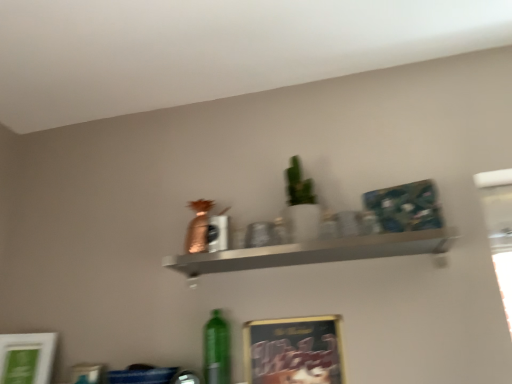
Question: Based on their positions, is metallic silver shelf at center located to the left or right of metallic gold picture frame at lower center, which is the 2th picture frame in left-to-right order?

Choices:
 (A) left
 (B) right

Answer: (B)

Question: Is metallic silver shelf at center bigger or smaller than metallic gold picture frame at lower center, marked as the 1th picture frame in a right-to-left arrangement?

Choices:
 (A) small
 (B) big

Answer: (B)

Question: Which is nearer to the green matte bottle at lower center?

Choices:
 (A) metallic silver shelf at center
 (B) metallic gold picture frame at lower center, marked as the 1th picture frame in a right-to-left arrangement
 (C) white matte picture frame at lower left, the 2th picture frame when ordered from right to left

Answer: (B)

Question: Considering the real-world distances, which object is farthest from the metallic silver shelf at center?

Choices:
 (A) metallic gold picture frame at lower center, which is the 2th picture frame in left-to-right order
 (B) green matte bottle at lower center
 (C) white matte picture frame at lower left, the first picture frame from the left

Answer: (C)